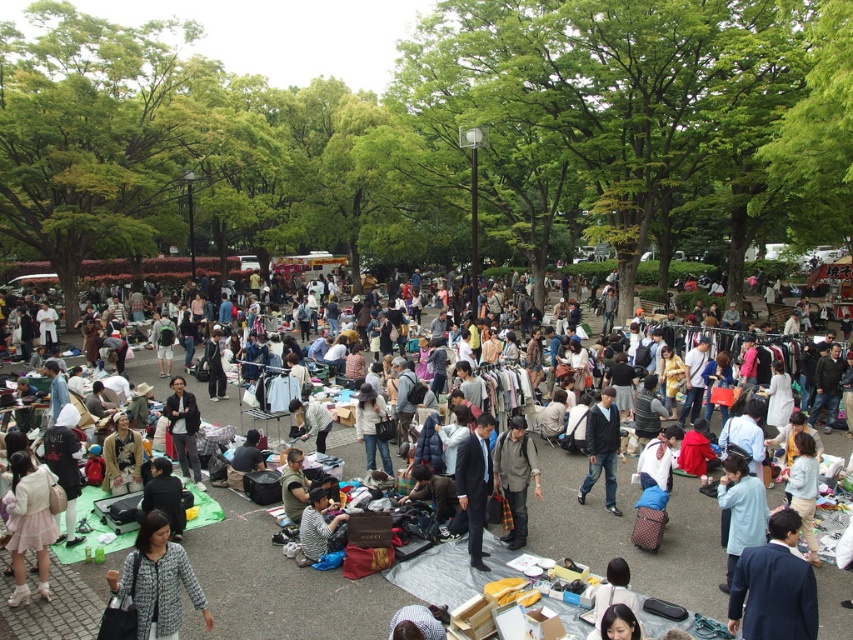
In the scene shown: Does light blue denim jacket at center have a lesser width compared to patterned fabric jacket at lower left?

Incorrect, light blue denim jacket at center's width is not less than patterned fabric jacket at lower left's.

At what (x,y) coordinates should I click in order to perform the action: click on light blue denim jacket at center. Please return your answer as a coordinate pair (x, y). The image size is (853, 640). Looking at the image, I should click on coord(277,584).

Between point (347, 476) and point (148, 625), which one is positioned in front?

Point (148, 625) is more forward.

Where is `light blue denim jacket at center`? The width and height of the screenshot is (853, 640). light blue denim jacket at center is located at coordinates (277, 584).

Measure the distance from dark blue suit at lower right to dark blue jeans at center.

4.52 meters

Is dark blue suit at lower right thinner than dark blue jeans at center?

No, dark blue suit at lower right is not thinner than dark blue jeans at center.

This screenshot has height=640, width=853. What do you see at coordinates (775, 586) in the screenshot?
I see `dark blue suit at lower right` at bounding box center [775, 586].

Find the location of `dark blue suit at lower right`. dark blue suit at lower right is located at coordinates (775, 586).

Based on the photo, is dark blue suit at lower right wider than dark blue suit at center?

Yes.

Is point (796, 540) closer to viewer compared to point (477, 486)?

Yes, point (796, 540) is closer to viewer.

At what (x,y) coordinates should I click in order to perform the action: click on dark blue suit at lower right. Please return your answer as a coordinate pair (x, y). This screenshot has width=853, height=640. Looking at the image, I should click on (775, 586).